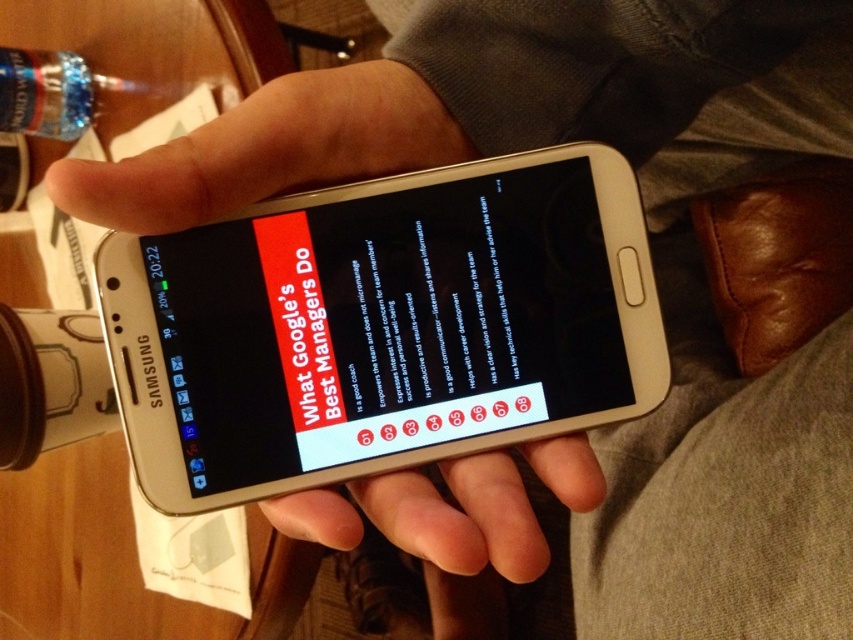
This screenshot has height=640, width=853. What are the coordinates of `matte black phone at center` in the screenshot? It's located at (389, 326).

Does matte black phone at center have a greater height compared to clear plastic bottle at upper left?

Correct, matte black phone at center is much taller as clear plastic bottle at upper left.

Is point (366, 460) farther from camera compared to point (74, 68)?

No, it is in front of (74, 68).

Identify the location of matte black phone at center. The height and width of the screenshot is (640, 853). (389, 326).

Does matte black phone at center have a greater width compared to white paper text at upper center?

Yes.

Is matte black phone at center thinner than white paper text at upper center?

In fact, matte black phone at center might be wider than white paper text at upper center.

Where is `matte black phone at center`? Image resolution: width=853 pixels, height=640 pixels. matte black phone at center is located at coordinates (389, 326).

Is the position of white paper text at upper center less distant than that of clear plastic bottle at upper left?

Yes, white paper text at upper center is closer to the viewer.

Does white paper text at upper center appear under clear plastic bottle at upper left?

Correct, white paper text at upper center is located below clear plastic bottle at upper left.

Identify the location of white paper text at upper center. (300, 332).